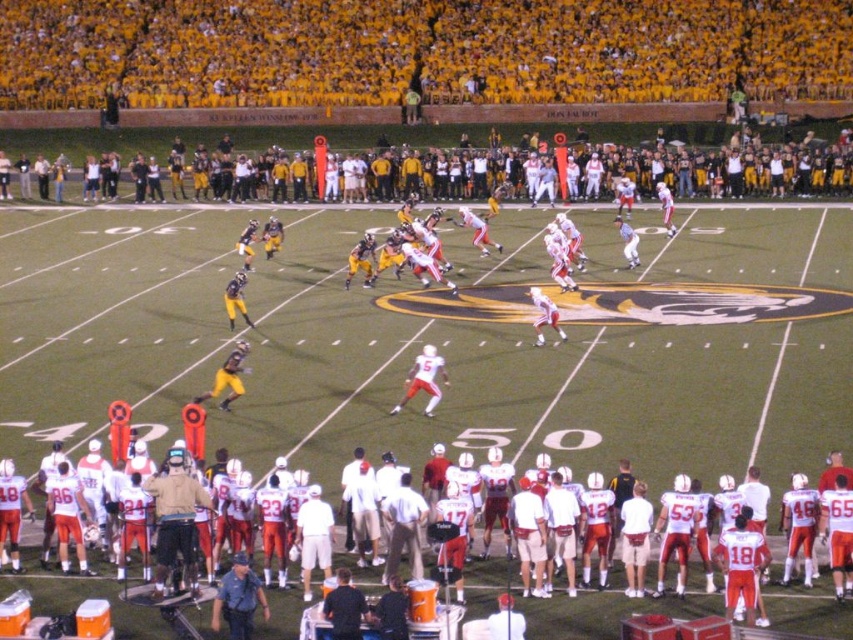
Question: Which point is farther from the camera taking this photo?

Choices:
 (A) (585, 634)
 (B) (584, 22)

Answer: (B)

Question: Among these objects, which one is nearest to the camera?

Choices:
 (A) yellow jersey at upper center
 (B) white matte uniform at center

Answer: (B)

Question: Which of the following is the closest to the observer?

Choices:
 (A) (579, 596)
 (B) (526, 12)

Answer: (A)

Question: Is yellow jersey at upper center positioned before white matte uniform at center?

Choices:
 (A) yes
 (B) no

Answer: (B)

Question: Is yellow jersey at upper center to the left of white matte uniform at center from the viewer's perspective?

Choices:
 (A) yes
 (B) no

Answer: (A)

Question: Can you confirm if yellow jersey at upper center is wider than white matte uniform at center?

Choices:
 (A) no
 (B) yes

Answer: (B)